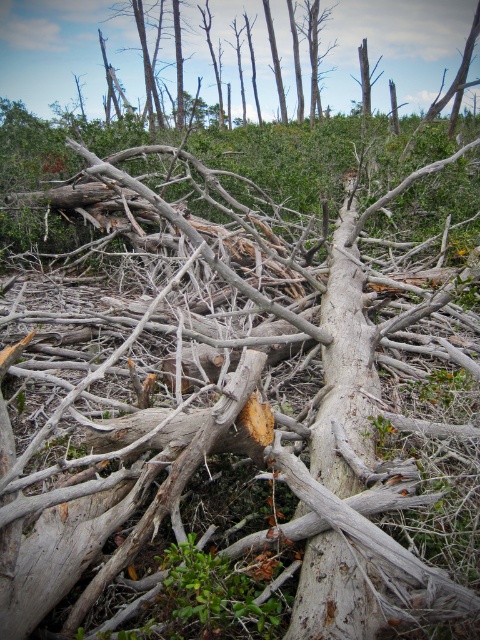
You are a park ranger assessing the damage after a storm. You notice the gray rough bark tree trunk at center and the gray bark tree at upper center. Which of these two objects has a smaller width?

The gray rough bark tree trunk at center has a smaller width than the gray bark tree at upper center.

You are a hiker navigating through a forest and see the gray rough bark tree trunk at center and the gray bark tree at upper center. Which object is closer to the ground?

The gray rough bark tree trunk at center is closer to the ground because it is located below the gray bark tree at upper center.